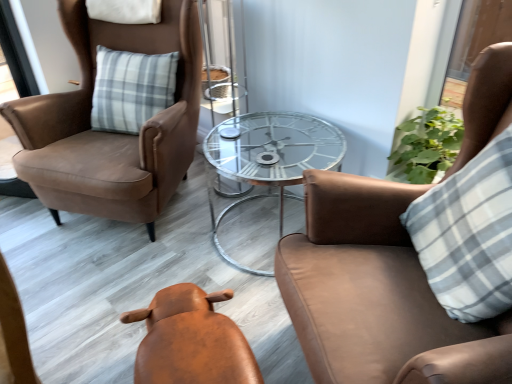
The height and width of the screenshot is (384, 512). What do you see at coordinates (468, 234) in the screenshot?
I see `white checkered pillow at right` at bounding box center [468, 234].

Describe the element at coordinates (376, 293) in the screenshot. I see `brown leather chair at upper right, which appears as the 3th chair when viewed from the left` at that location.

What do you see at coordinates (106, 132) in the screenshot?
I see `suede brown armchair at left, marked as the first chair in a left-to-right arrangement` at bounding box center [106, 132].

The height and width of the screenshot is (384, 512). I want to click on white checkered pillow at right, so click(x=468, y=234).

From a real-world perspective, is suede brown armchair at left, marked as the first chair in a left-to-right arrangement, located higher than transparent glass table at center?

Yes, from a real-world perspective, suede brown armchair at left, marked as the first chair in a left-to-right arrangement, is on top of transparent glass table at center.

Is suede brown armchair at left, marked as the first chair in a left-to-right arrangement, oriented away from transparent glass table at center?

No, suede brown armchair at left, marked as the first chair in a left-to-right arrangement, is not facing the opposite direction of transparent glass table at center.

Considering the positions of objects suede brown armchair at left, marked as the first chair in a left-to-right arrangement, and transparent glass table at center in the image provided, who is more to the right, suede brown armchair at left, marked as the first chair in a left-to-right arrangement, or transparent glass table at center?

Positioned to the right is transparent glass table at center.

This screenshot has height=384, width=512. Find the location of `the 2nd chair above the transparent glass table at center (from a real-world perspective)`. the 2nd chair above the transparent glass table at center (from a real-world perspective) is located at coordinates (106, 132).

Are leather stool at center, which appears as the 2th chair when viewed from the right, and white checkered pillow at right far apart?

No, there isn't a large distance between leather stool at center, which appears as the 2th chair when viewed from the right, and white checkered pillow at right.

Is leather stool at center, which is counted as the second chair, starting from the left, wider than white checkered pillow at right?

Yes, leather stool at center, which is counted as the second chair, starting from the left, is wider than white checkered pillow at right.

Considering the positions of points (244, 376) and (493, 238), is point (244, 376) closer to camera compared to point (493, 238)?

Yes, it is in front of point (493, 238).

Considering the relative sizes of leather stool at center, which appears as the 2th chair when viewed from the right, and white checkered pillow at right in the image provided, is leather stool at center, which appears as the 2th chair when viewed from the right, bigger than white checkered pillow at right?

No.

You are a GUI agent. You are given a task and a screenshot of the screen. Output one action in this format:
    pyautogui.click(x=<x>, y=<y>)
    Task: Click on the table above the leather stool at center, which is counted as the second chair, starting from the left (from the image's perspective)
    The height and width of the screenshot is (384, 512).
    Given the screenshot: What is the action you would take?
    pyautogui.click(x=268, y=158)

From the image's perspective, which is below, leather stool at center, which appears as the 2th chair when viewed from the right, or transparent glass table at center?

leather stool at center, which appears as the 2th chair when viewed from the right, is shown below in the image.

From the picture: Which object is more forward, leather stool at center, which appears as the 2th chair when viewed from the right, or transparent glass table at center?

leather stool at center, which appears as the 2th chair when viewed from the right.

Which of these two, leather stool at center, which is counted as the second chair, starting from the left, or transparent glass table at center, is bigger?

transparent glass table at center.

From the image's perspective, which is below, brown leather chair at upper right, which appears as the 3th chair when viewed from the left, or transparent glass table at center?

brown leather chair at upper right, which appears as the 3th chair when viewed from the left, appears lower in the image.

Considering the positions of objects brown leather chair at upper right, which ranks as the first chair in right-to-left order, and transparent glass table at center in the image provided, who is more to the right, brown leather chair at upper right, which ranks as the first chair in right-to-left order, or transparent glass table at center?

From the viewer's perspective, brown leather chair at upper right, which ranks as the first chair in right-to-left order, appears more on the right side.

Looking at the image, does brown leather chair at upper right, which ranks as the first chair in right-to-left order, seem bigger or smaller compared to transparent glass table at center?

In the image, brown leather chair at upper right, which ranks as the first chair in right-to-left order, appears to be larger than transparent glass table at center.

Is brown leather chair at upper right, which appears as the 3th chair when viewed from the left, facing away from transparent glass table at center?

No.

From the image's perspective, relative to suede brown armchair at left, the 3th chair when ordered from right to left, is transparent glass table at center above or below?

transparent glass table at center is situated lower than suede brown armchair at left, the 3th chair when ordered from right to left, in the image.

Is point (256, 122) positioned after point (194, 133)?

No, it is not.

Could you tell me if transparent glass table at center is facing suede brown armchair at left, marked as the first chair in a left-to-right arrangement?

No, transparent glass table at center is not oriented towards suede brown armchair at left, marked as the first chair in a left-to-right arrangement.

From a real-world perspective, which chair is the 2nd one above the transparent glass table at center? Please provide its 2D coordinates.

[(106, 132)]

Based on their sizes in the image, would you say white checkered pillow at right is bigger or smaller than brown leather chair at upper right, which appears as the 3th chair when viewed from the left?

Considering their sizes, white checkered pillow at right takes up less space than brown leather chair at upper right, which appears as the 3th chair when viewed from the left.

Looking at this image, in the image, is white checkered pillow at right positioned in front of or behind brown leather chair at upper right, which appears as the 3th chair when viewed from the left?

Clearly, white checkered pillow at right is behind brown leather chair at upper right, which appears as the 3th chair when viewed from the left.

From the image's perspective, which is above, white checkered pillow at right or brown leather chair at upper right, which ranks as the first chair in right-to-left order?

white checkered pillow at right is shown above in the image.

From the picture: From the image's perspective, does leather stool at center, which appears as the 2th chair when viewed from the right, appear lower than suede brown armchair at left, the 3th chair when ordered from right to left?

Yes, from the image's perspective, leather stool at center, which appears as the 2th chair when viewed from the right, is below suede brown armchair at left, the 3th chair when ordered from right to left.

From a real-world perspective, is leather stool at center, which is counted as the second chair, starting from the left, positioned under suede brown armchair at left, marked as the first chair in a left-to-right arrangement, based on gravity?

Yes, from a real-world perspective, leather stool at center, which is counted as the second chair, starting from the left, is beneath suede brown armchair at left, marked as the first chair in a left-to-right arrangement.

In the scene shown: How many degrees apart are the facing directions of leather stool at center, which is counted as the second chair, starting from the left, and suede brown armchair at left, the 3th chair when ordered from right to left?

There is a 146-degree angle between the facing directions of leather stool at center, which is counted as the second chair, starting from the left, and suede brown armchair at left, the 3th chair when ordered from right to left.

Is there a large distance between leather stool at center, which is counted as the second chair, starting from the left, and suede brown armchair at left, the 3th chair when ordered from right to left?

No, leather stool at center, which is counted as the second chair, starting from the left, is not far away from suede brown armchair at left, the 3th chair when ordered from right to left.

From a real-world perspective, starting from the transparent glass table at center, which chair is the 2nd one vertically above it? Please provide its 2D coordinates.

[(106, 132)]

Locate an element on the screen. Image resolution: width=512 pixels, height=384 pixels. pillow that appears above the leather stool at center, which is counted as the second chair, starting from the left (from the image's perspective) is located at coordinates (468, 234).

From the image, which object appears to be farther from brown leather chair at upper right, which appears as the 3th chair when viewed from the left, transparent glass table at center or leather stool at center, which is counted as the second chair, starting from the left?

transparent glass table at center is further to brown leather chair at upper right, which appears as the 3th chair when viewed from the left.

Looking at this image, from the image, which object appears to be farther from leather stool at center, which is counted as the second chair, starting from the left, brown leather chair at upper right, which ranks as the first chair in right-to-left order, or suede brown armchair at left, the 3th chair when ordered from right to left?

suede brown armchair at left, the 3th chair when ordered from right to left, is further to leather stool at center, which is counted as the second chair, starting from the left.

Looking at the image, which one is located further to white checkered pillow at right, brown leather chair at upper right, which ranks as the first chair in right-to-left order, or suede brown armchair at left, marked as the first chair in a left-to-right arrangement?

suede brown armchair at left, marked as the first chair in a left-to-right arrangement.

Consider the image. When comparing their distances from leather stool at center, which appears as the 2th chair when viewed from the right, does suede brown armchair at left, the 3th chair when ordered from right to left, or transparent glass table at center seem closer?

Among the two, transparent glass table at center is located nearer to leather stool at center, which appears as the 2th chair when viewed from the right.

Estimate the real-world distances between objects in this image. Which object is further from suede brown armchair at left, marked as the first chair in a left-to-right arrangement, leather stool at center, which appears as the 2th chair when viewed from the right, or white checkered pillow at right?

white checkered pillow at right is positioned further to the anchor suede brown armchair at left, marked as the first chair in a left-to-right arrangement.

Which object lies nearer to the anchor point transparent glass table at center, leather stool at center, which appears as the 2th chair when viewed from the right, or suede brown armchair at left, marked as the first chair in a left-to-right arrangement?

suede brown armchair at left, marked as the first chair in a left-to-right arrangement, is closer to transparent glass table at center.

From the image, which object appears to be farther from transparent glass table at center, brown leather chair at upper right, which appears as the 3th chair when viewed from the left, or suede brown armchair at left, marked as the first chair in a left-to-right arrangement?

brown leather chair at upper right, which appears as the 3th chair when viewed from the left.

Which object lies nearer to the anchor point suede brown armchair at left, marked as the first chair in a left-to-right arrangement, transparent glass table at center or white checkered pillow at right?

Based on the image, transparent glass table at center appears to be nearer to suede brown armchair at left, marked as the first chair in a left-to-right arrangement.

Find the location of `table located between suede brown armchair at left, the 3th chair when ordered from right to left, and brown leather chair at upper right, which appears as the 3th chair when viewed from the left, in the left-right direction`. table located between suede brown armchair at left, the 3th chair when ordered from right to left, and brown leather chair at upper right, which appears as the 3th chair when viewed from the left, in the left-right direction is located at coordinates (268, 158).

The width and height of the screenshot is (512, 384). I want to click on chair between leather stool at center, which is counted as the second chair, starting from the left, and white checkered pillow at right, so click(376, 293).

Locate an element on the screen. table between suede brown armchair at left, marked as the first chair in a left-to-right arrangement, and leather stool at center, which is counted as the second chair, starting from the left, vertically is located at coordinates (268, 158).

You are a GUI agent. You are given a task and a screenshot of the screen. Output one action in this format:
    pyautogui.click(x=<x>, y=<y>)
    Task: Click on the table located between suede brown armchair at left, marked as the first chair in a left-to-right arrangement, and white checkered pillow at right in the left-right direction
    Image resolution: width=512 pixels, height=384 pixels.
    Given the screenshot: What is the action you would take?
    pyautogui.click(x=268, y=158)